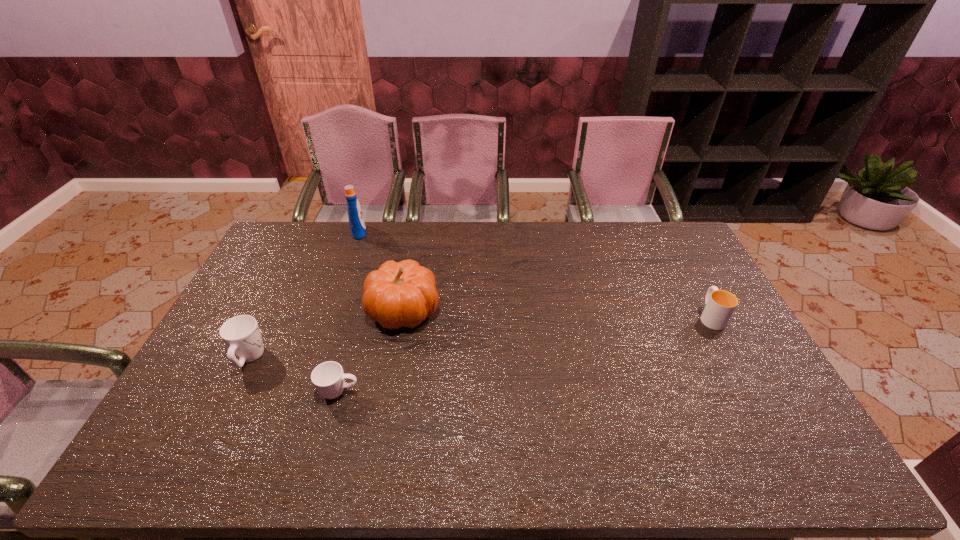
What are the coordinates of `free space located 0.260m on the front of the second tallest object` in the screenshot? It's located at (384, 415).

This screenshot has width=960, height=540. Find the location of `free space located 0.370m on the side of the leftmost object with the handle`. free space located 0.370m on the side of the leftmost object with the handle is located at coordinates (297, 263).

Where is `vacant space located 0.100m on the side of the leftmost object with the handle`? The width and height of the screenshot is (960, 540). vacant space located 0.100m on the side of the leftmost object with the handle is located at coordinates (270, 317).

At what (x,y) coordinates should I click in order to perform the action: click on vacant region located 0.400m on the side of the leftmost object with the handle. Please return your answer as a coordinate pair (x, y). Looking at the image, I should click on (299, 258).

Where is `vacant region located with the handle on the side of the right cup`? Image resolution: width=960 pixels, height=540 pixels. vacant region located with the handle on the side of the right cup is located at coordinates (685, 270).

Identify the location of free spot located with the handle on the side of the right cup. The image size is (960, 540). (684, 268).

Locate an element on the screen. vacant space located with the handle on the side of the right cup is located at coordinates (674, 249).

The width and height of the screenshot is (960, 540). What are the coordinates of `free region located 0.250m with the handle on the side of the nearest object` in the screenshot? It's located at (x=453, y=392).

Image resolution: width=960 pixels, height=540 pixels. I want to click on object at the far edge, so click(356, 221).

You are a GUI agent. You are given a task and a screenshot of the screen. Output one action in this format:
    pyautogui.click(x=<x>, y=<y>)
    Task: Click on the object located in the left edge section of the desktop
    The width and height of the screenshot is (960, 540).
    Given the screenshot: What is the action you would take?
    pyautogui.click(x=241, y=334)